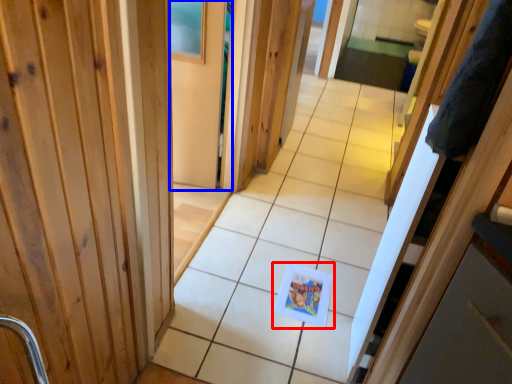
Question: Which object appears closest to the camera in this image, postcard (highlighted by a red box) or screen door (highlighted by a blue box)?

Choices:
 (A) postcard
 (B) screen door

Answer: (A)